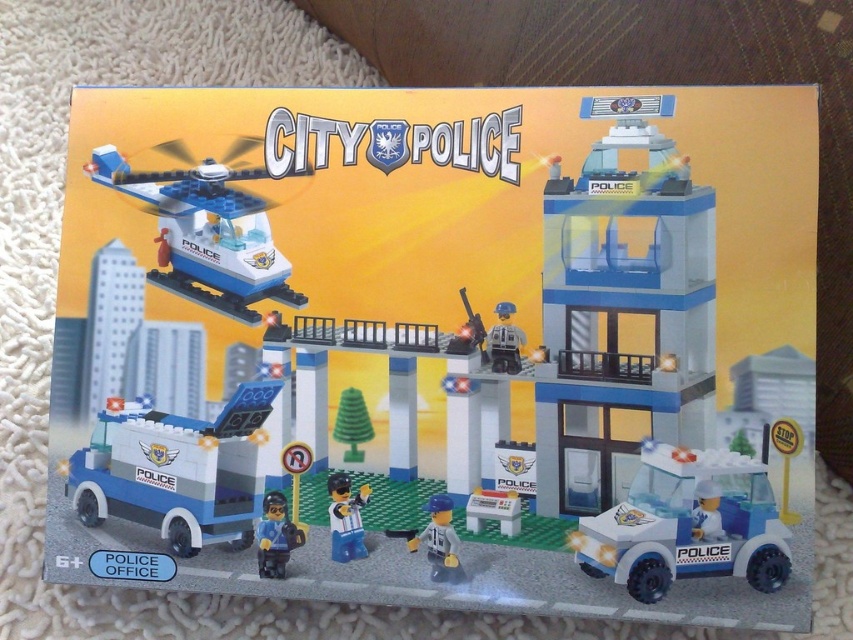
What do you see at coordinates (439, 541) in the screenshot? This screenshot has width=853, height=640. I see `light gray plastic minifigure at center` at bounding box center [439, 541].

Who is more distant from viewer, [428,538] or [473,342]?

The point [473,342] is behind.

This screenshot has width=853, height=640. I want to click on light gray plastic minifigure at center, so [439, 541].

Where is `light gray plastic minifigure at center`? The width and height of the screenshot is (853, 640). light gray plastic minifigure at center is located at coordinates (439, 541).

Does blue plastic helicopter at upper left lie in front of green matte tree at center?

No, blue plastic helicopter at upper left is behind green matte tree at center.

Which is behind, point (167, 189) or point (354, 426)?

Positioned behind is point (167, 189).

Based on the photo, who is more forward, (252,323) or (369,433)?

Point (369,433) is in front.

The height and width of the screenshot is (640, 853). I want to click on blue plastic helicopter at upper left, so click(x=206, y=234).

Between point (149, 420) and point (467, 321), which one is positioned behind?

Positioned behind is point (149, 420).

The width and height of the screenshot is (853, 640). What do you see at coordinates (177, 468) in the screenshot?
I see `blue plastic police van at lower left` at bounding box center [177, 468].

Is point (236, 456) farther from viewer compared to point (469, 330)?

Yes, it is behind point (469, 330).

At what (x,y) coordinates should I click in order to perform the action: click on blue plastic police van at lower left. Please return your answer as a coordinate pair (x, y). This screenshot has width=853, height=640. Looking at the image, I should click on (177, 468).